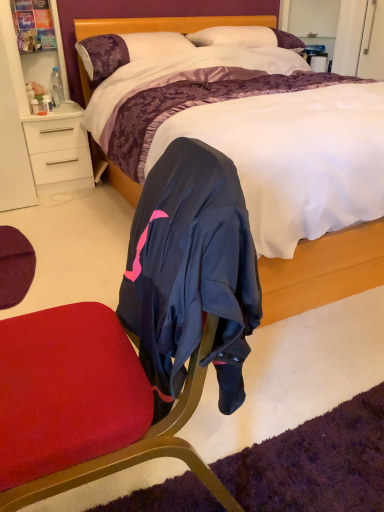
The height and width of the screenshot is (512, 384). What are the coordinates of `clear plastic bottle at left` in the screenshot? It's located at (56, 87).

Describe the element at coordinates (323, 271) in the screenshot. I see `satin purple bed at center` at that location.

Image resolution: width=384 pixels, height=512 pixels. I want to click on purple satin pillow at upper left, the 1th pillow when ordered from left to right, so (125, 50).

What do you see at coordinates (125, 50) in the screenshot? I see `purple satin pillow at upper left, the 1th pillow when ordered from left to right` at bounding box center [125, 50].

Image resolution: width=384 pixels, height=512 pixels. I want to click on white glossy drawer at left, so click(59, 150).

From the picture: From the image's perspective, between purple satin pillow at upper left, the 1th pillow when ordered from left to right, and white soft pillow at upper center, acting as the 1th pillow starting from the right, which one is located above?

From the image's view, white soft pillow at upper center, acting as the 1th pillow starting from the right, is above.

Looking at this image, could you tell me if purple satin pillow at upper left, placed as the second pillow when sorted from right to left, is turned towards white soft pillow at upper center, acting as the 2th pillow starting from the left?

No, purple satin pillow at upper left, placed as the second pillow when sorted from right to left, is not aimed at white soft pillow at upper center, acting as the 2th pillow starting from the left.

Considering the sizes of objects purple satin pillow at upper left, the 1th pillow when ordered from left to right, and white soft pillow at upper center, acting as the 1th pillow starting from the right, in the image provided, who is wider, purple satin pillow at upper left, the 1th pillow when ordered from left to right, or white soft pillow at upper center, acting as the 1th pillow starting from the right,?

purple satin pillow at upper left, the 1th pillow when ordered from left to right, is wider.

Can you confirm if purple satin pillow at upper left, the 1th pillow when ordered from left to right, is bigger than white soft pillow at upper center, acting as the 1th pillow starting from the right?

Indeed, purple satin pillow at upper left, the 1th pillow when ordered from left to right, has a larger size compared to white soft pillow at upper center, acting as the 1th pillow starting from the right.

Considering the sizes of objects white soft pillow at upper center, acting as the 1th pillow starting from the right, and purple satin pillow at upper left, placed as the second pillow when sorted from right to left, in the image provided, who is taller, white soft pillow at upper center, acting as the 1th pillow starting from the right, or purple satin pillow at upper left, placed as the second pillow when sorted from right to left,?

purple satin pillow at upper left, placed as the second pillow when sorted from right to left.

Does point (254, 34) appear closer or farther from the camera than point (97, 78)?

Point (254, 34) is positioned farther from the camera compared to point (97, 78).

From a real-world perspective, is white soft pillow at upper center, acting as the 1th pillow starting from the right, located higher than purple satin pillow at upper left, the 1th pillow when ordered from left to right?

Correct, in the physical world, white soft pillow at upper center, acting as the 1th pillow starting from the right, is higher than purple satin pillow at upper left, the 1th pillow when ordered from left to right.

Looking at their sizes, would you say white soft pillow at upper center, acting as the 2th pillow starting from the left, is wider or thinner than purple satin pillow at upper left, the 1th pillow when ordered from left to right?

Considering their sizes, white soft pillow at upper center, acting as the 2th pillow starting from the left, looks slimmer than purple satin pillow at upper left, the 1th pillow when ordered from left to right.

Is purple satin pillow at upper left, placed as the second pillow when sorted from right to left, not near clear plastic bottle at left?

purple satin pillow at upper left, placed as the second pillow when sorted from right to left, is near clear plastic bottle at left, not far away.

Is purple satin pillow at upper left, placed as the second pillow when sorted from right to left, facing towards clear plastic bottle at left?

No, purple satin pillow at upper left, placed as the second pillow when sorted from right to left, is not facing towards clear plastic bottle at left.

Considering the points (120, 57) and (57, 87), which point is behind, point (120, 57) or point (57, 87)?

The point (57, 87) is behind.

From the image's perspective, is purple satin pillow at upper left, placed as the second pillow when sorted from right to left, on top of clear plastic bottle at left?

Yes, from the image's perspective, purple satin pillow at upper left, placed as the second pillow when sorted from right to left, is over clear plastic bottle at left.

Is point (57, 105) closer to viewer compared to point (71, 146)?

Yes, point (57, 105) is closer to viewer.

From the picture: In terms of size, does clear plastic bottle at left appear bigger or smaller than white glossy drawer at left?

Clearly, clear plastic bottle at left is smaller in size than white glossy drawer at left.

From a real-world perspective, does clear plastic bottle at left sit lower than white glossy drawer at left?

No, from a real-world perspective, clear plastic bottle at left is not below white glossy drawer at left.

Based on the photo, is clear plastic bottle at left next to satin purple bed at center?

No, clear plastic bottle at left is not in contact with satin purple bed at center.

Is clear plastic bottle at left aimed at satin purple bed at center?

Yes, clear plastic bottle at left is aimed at satin purple bed at center.

Which of these two, clear plastic bottle at left or satin purple bed at center, is wider?

With larger width is satin purple bed at center.

This screenshot has width=384, height=512. Identify the location of bottle above the satin purple bed at center (from the image's perspective). (56, 87).

What's the angular difference between white soft pillow at upper center, acting as the 1th pillow starting from the right, and satin purple bed at center's facing directions?

The facing directions of white soft pillow at upper center, acting as the 1th pillow starting from the right, and satin purple bed at center are 0.686 degrees apart.

Which object is further away from the camera taking this photo, white soft pillow at upper center, acting as the 1th pillow starting from the right, or satin purple bed at center?

white soft pillow at upper center, acting as the 1th pillow starting from the right, is more distant.

Could you measure the distance between white soft pillow at upper center, acting as the 1th pillow starting from the right, and satin purple bed at center?

A distance of 1.77 meters exists between white soft pillow at upper center, acting as the 1th pillow starting from the right, and satin purple bed at center.

Who is smaller, white soft pillow at upper center, acting as the 1th pillow starting from the right, or satin purple bed at center?

white soft pillow at upper center, acting as the 1th pillow starting from the right, is smaller.

Between satin purple bed at center and white glossy drawer at left, which one appears on the right side from the viewer's perspective?

satin purple bed at center is more to the right.

From the image's perspective, which one is positioned higher, satin purple bed at center or white glossy drawer at left?

satin purple bed at center appears higher in the image.

Are satin purple bed at center and white glossy drawer at left making contact?

No.

I want to click on pillow behind the purple satin pillow at upper left, the 1th pillow when ordered from left to right, so click(x=246, y=37).

Identify the location of pillow below the white soft pillow at upper center, acting as the 2th pillow starting from the left (from the image's perspective). This screenshot has width=384, height=512. (125, 50).

When comparing their distances from satin purple bed at center, does clear plastic bottle at left or white soft pillow at upper center, acting as the 1th pillow starting from the right, seem closer?

Based on the image, white soft pillow at upper center, acting as the 1th pillow starting from the right, appears to be nearer to satin purple bed at center.

When comparing their distances from satin purple bed at center, does white soft pillow at upper center, acting as the 1th pillow starting from the right, or purple satin pillow at upper left, placed as the second pillow when sorted from right to left, seem closer?

Based on the image, purple satin pillow at upper left, placed as the second pillow when sorted from right to left, appears to be nearer to satin purple bed at center.

Considering their positions, is white soft pillow at upper center, acting as the 1th pillow starting from the right, positioned closer to purple satin pillow at upper left, placed as the second pillow when sorted from right to left, than satin purple bed at center?

white soft pillow at upper center, acting as the 1th pillow starting from the right, is closer to purple satin pillow at upper left, placed as the second pillow when sorted from right to left.

Consider the image. Based on their spatial positions, is white soft pillow at upper center, acting as the 2th pillow starting from the left, or satin purple bed at center further from clear plastic bottle at left?

satin purple bed at center.

Which object lies nearer to the anchor point white glossy drawer at left, white soft pillow at upper center, acting as the 2th pillow starting from the left, or purple satin pillow at upper left, the 1th pillow when ordered from left to right?

purple satin pillow at upper left, the 1th pillow when ordered from left to right, is positioned closer to the anchor white glossy drawer at left.

Looking at the image, which one is located further to satin purple bed at center, clear plastic bottle at left or white glossy drawer at left?

The object further to satin purple bed at center is clear plastic bottle at left.

When comparing their distances from satin purple bed at center, does white glossy drawer at left or clear plastic bottle at left seem further?

Among the two, clear plastic bottle at left is located further to satin purple bed at center.

Looking at the image, which one is located further to white glossy drawer at left, satin purple bed at center or clear plastic bottle at left?

Based on the image, satin purple bed at center appears to be further to white glossy drawer at left.

The image size is (384, 512). In order to click on bottle between white glossy drawer at left and white soft pillow at upper center, acting as the 2th pillow starting from the left, in the horizontal direction in this screenshot , I will do `click(56, 87)`.

Locate an element on the screen. pillow between satin purple bed at center and white glossy drawer at left in the front-back direction is located at coordinates (125, 50).

The height and width of the screenshot is (512, 384). In order to click on pillow between clear plastic bottle at left and white soft pillow at upper center, acting as the 1th pillow starting from the right, from left to right in this screenshot , I will do `click(125, 50)`.

Locate an element on the screen. bottle between white glossy drawer at left and purple satin pillow at upper left, the 1th pillow when ordered from left to right, from left to right is located at coordinates (56, 87).